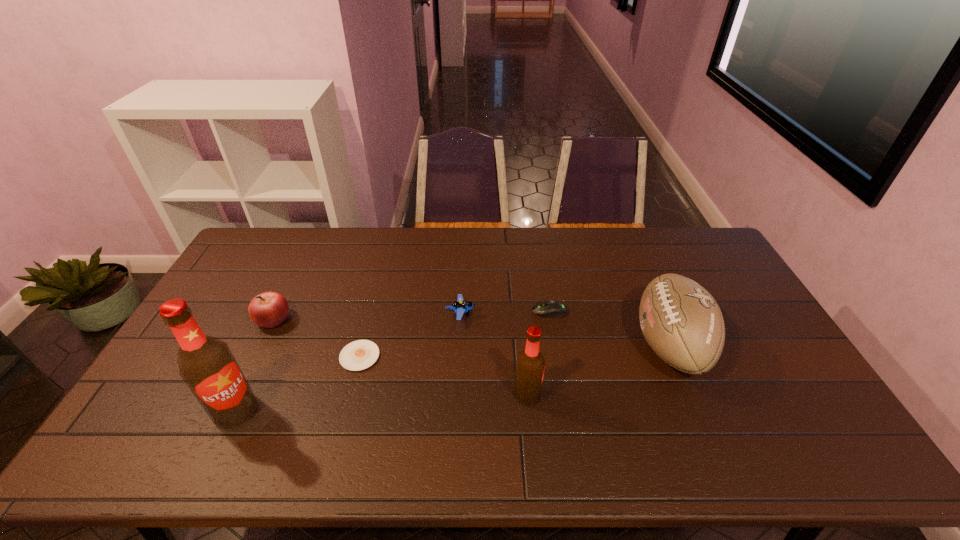
Locate an element on the screen. the taller beer bottle is located at coordinates (206, 364).

Find the location of `the tallest object`. the tallest object is located at coordinates (206, 364).

In order to click on the shorter beer bottle in this screenshot , I will do `click(530, 365)`.

Where is `the fifth object from left to right`? The image size is (960, 540). the fifth object from left to right is located at coordinates (530, 365).

You are a GUI agent. You are given a task and a screenshot of the screen. Output one action in this format:
    pyautogui.click(x=<x>, y=<y>)
    Task: Click on the Lego
    
    Given the screenshot: What is the action you would take?
    pyautogui.click(x=460, y=307)

Locate an element on the screen. Image resolution: width=960 pixels, height=540 pixels. the fifth tallest object is located at coordinates (460, 307).

Locate an element on the screen. Image resolution: width=960 pixels, height=540 pixels. the third tallest object is located at coordinates (681, 321).

Find the location of a particular element. The width and height of the screenshot is (960, 540). football (American) is located at coordinates (681, 321).

The height and width of the screenshot is (540, 960). I want to click on apple, so click(x=269, y=309).

You are a GUI agent. You are given a task and a screenshot of the screen. Output one action in this format:
    pyautogui.click(x=<x>, y=<y>)
    Task: Click on the egg yolk
    This screenshot has width=960, height=540.
    Given the screenshot: What is the action you would take?
    pyautogui.click(x=358, y=355)